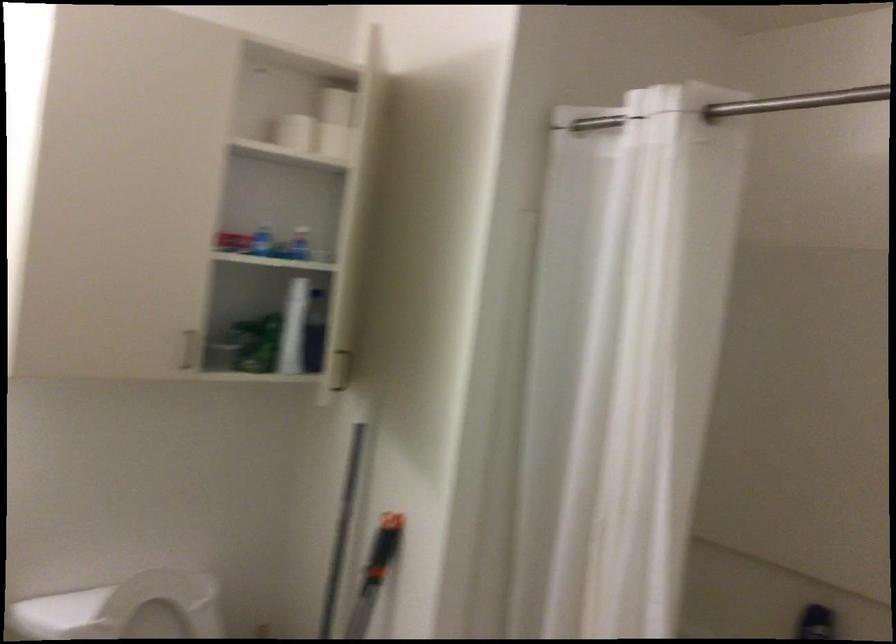
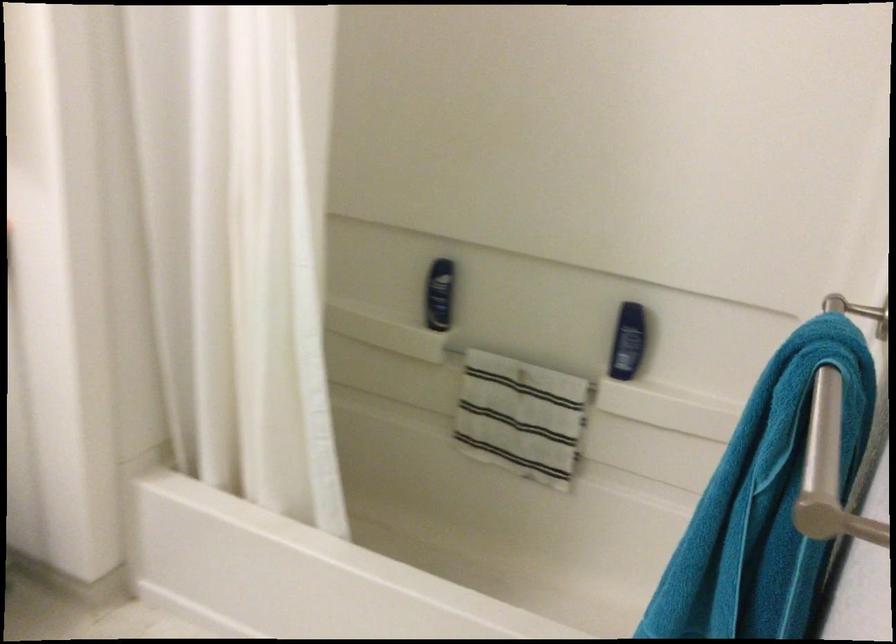
The first image is from the beginning of the video and the second image is from the end. How did the camera likely rotate when shooting the video?

The camera's rotation is toward right-down.